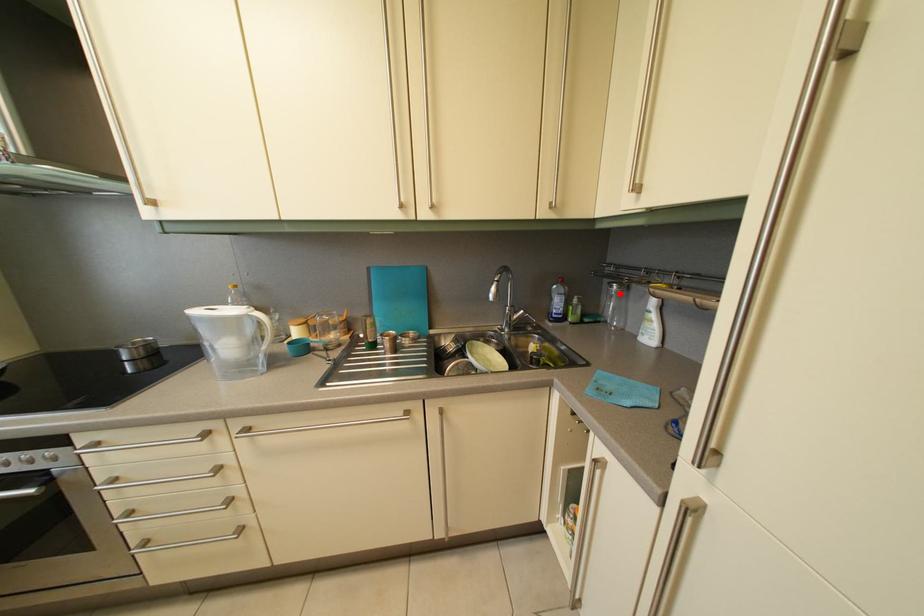
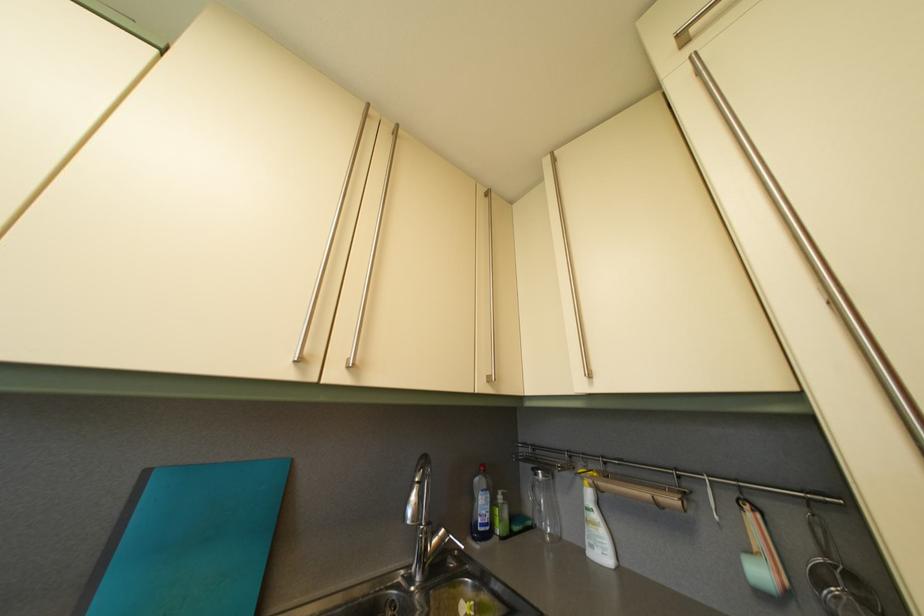
Question: A red point is marked in image1. In image2, is the corresponding 3D point closer to the camera or farther? Reply with the corresponding letter.

Choices:
 (A) The corresponding 3D point is closer.
 (B) The corresponding 3D point is farther.

Answer: (B)